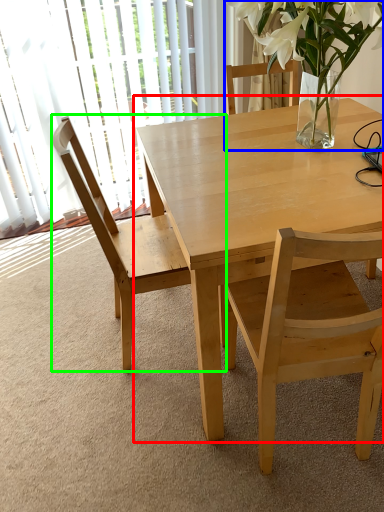
Question: Which is farther away from kitchen & dining room table (highlighted by a red box)? houseplant (highlighted by a blue box) or chair (highlighted by a green box)?

Choices:
 (A) houseplant
 (B) chair

Answer: (B)